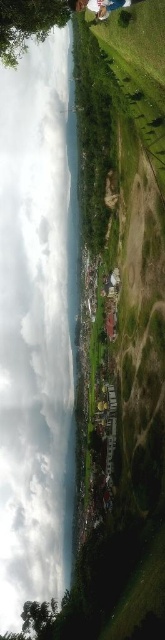
Question: Does transparent water at center appear on the left side of green leafy tree at lower left?

Choices:
 (A) no
 (B) yes

Answer: (B)

Question: Among these objects, which one is farthest from the camera?

Choices:
 (A) green leafy tree at lower left
 (B) transparent water at center

Answer: (B)

Question: Does green leafy tree at upper left appear under green leafy tree at lower left?

Choices:
 (A) yes
 (B) no

Answer: (B)

Question: Which object is the farthest from the green leafy tree at upper left?

Choices:
 (A) green leafy tree at lower left
 (B) transparent water at center

Answer: (A)

Question: Is green leafy tree at upper left to the left of green leafy tree at lower left from the viewer's perspective?

Choices:
 (A) yes
 (B) no

Answer: (B)

Question: Which point is farther from the camera taking this photo?

Choices:
 (A) (39, 275)
 (B) (46, 634)
 (C) (36, 35)

Answer: (A)